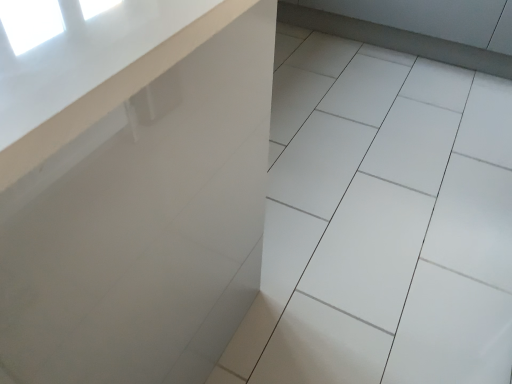
Question: Is white glossy tile at center to the left or to the right of white glossy counter at upper left in the image?

Choices:
 (A) right
 (B) left

Answer: (A)

Question: Is white glossy tile at center wider or thinner than white glossy counter at upper left?

Choices:
 (A) wide
 (B) thin

Answer: (A)

Question: Choose the correct answer: Is white glossy tile at center inside white glossy counter at upper left or outside it?

Choices:
 (A) outside
 (B) inside

Answer: (A)

Question: Is white glossy counter at upper left inside the boundaries of white glossy tile at center, or outside?

Choices:
 (A) inside
 (B) outside

Answer: (B)

Question: Is white glossy counter at upper left to the left or to the right of white glossy tile at center in the image?

Choices:
 (A) right
 (B) left

Answer: (B)

Question: From the image's perspective, is white glossy counter at upper left located above or below white glossy tile at center?

Choices:
 (A) below
 (B) above

Answer: (A)

Question: In terms of width, does white glossy counter at upper left look wider or thinner when compared to white glossy tile at center?

Choices:
 (A) thin
 (B) wide

Answer: (A)